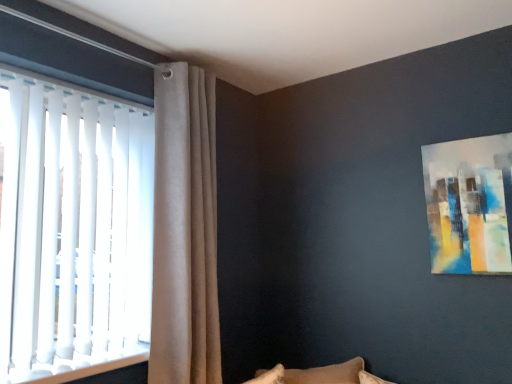
Where is `abstract painting at upper right`? This screenshot has width=512, height=384. abstract painting at upper right is located at coordinates (469, 204).

Measure the distance between point [499,211] and camera.

The depth of point [499,211] is 1.83 meters.

Find the location of `white vertical blinds at left`. white vertical blinds at left is located at coordinates (72, 228).

Does white vertical blinds at left appear on the left side of abstract painting at upper right?

Correct, you'll find white vertical blinds at left to the left of abstract painting at upper right.

Is white vertical blinds at left bigger than abstract painting at upper right?

Correct, white vertical blinds at left is larger in size than abstract painting at upper right.

Measure the distance between white vertical blinds at left and abstract painting at upper right.

The distance of white vertical blinds at left from abstract painting at upper right is 5.10 feet.

From a real-world perspective, which is physically below, white vertical blinds at left or abstract painting at upper right?

white vertical blinds at left, from a real-world perspective.

Can you see white vertical blinds at left touching beige velvet curtain at upper left?

No, white vertical blinds at left is not with beige velvet curtain at upper left.

In the scene shown: Is white vertical blinds at left to the right of beige velvet curtain at upper left from the viewer's perspective?

Incorrect, white vertical blinds at left is not on the right side of beige velvet curtain at upper left.

The width and height of the screenshot is (512, 384). I want to click on curtain located on the right of white vertical blinds at left, so click(185, 230).

From their relative heights in the image, would you say white vertical blinds at left is taller or shorter than beige velvet curtain at upper left?

Clearly, white vertical blinds at left is shorter compared to beige velvet curtain at upper left.

From a real-world perspective, is abstract painting at upper right physically located above or below white vertical blinds at left?

Clearly, from a real-world perspective, abstract painting at upper right is above white vertical blinds at left.

Is point (498, 237) less distant than point (9, 92)?

No.

From the image's perspective, which one is positioned lower, abstract painting at upper right or white vertical blinds at left?

From the image's view, white vertical blinds at left is below.

Is white vertical blinds at left a part of abstract painting at upper right?

No.

Which object is positioned more to the right, abstract painting at upper right or beige velvet curtain at upper left?

abstract painting at upper right is more to the right.

Does abstract painting at upper right contain beige velvet curtain at upper left?

Actually, beige velvet curtain at upper left is outside abstract painting at upper right.

Does abstract painting at upper right have a greater width compared to beige velvet curtain at upper left?

No.

From a real-world perspective, which is physically below, beige velvet curtain at upper left or abstract painting at upper right?

beige velvet curtain at upper left, from a real-world perspective.

Is beige velvet curtain at upper left bigger or smaller than abstract painting at upper right?

beige velvet curtain at upper left is bigger than abstract painting at upper right.

Are beige velvet curtain at upper left and abstract painting at upper right far apart?

Yes, beige velvet curtain at upper left and abstract painting at upper right are quite far apart.

Considering the relative sizes of beige velvet curtain at upper left and abstract painting at upper right in the image provided, is beige velvet curtain at upper left shorter than abstract painting at upper right?

No.

Does beige velvet curtain at upper left appear on the right side of white vertical blinds at left?

Indeed, beige velvet curtain at upper left is positioned on the right side of white vertical blinds at left.

What's the angular difference between beige velvet curtain at upper left and white vertical blinds at left's facing directions?

The angular difference between beige velvet curtain at upper left and white vertical blinds at left is 0.00195 degrees.

Between beige velvet curtain at upper left and white vertical blinds at left, which one has less height?

white vertical blinds at left.

Does beige velvet curtain at upper left have a lesser width compared to white vertical blinds at left?

No.

Image resolution: width=512 pixels, height=384 pixels. What are the coordinates of `window to the left of abstract painting at upper right` in the screenshot? It's located at (72, 228).

In order to click on window in front of the beige velvet curtain at upper left in this screenshot , I will do `click(72, 228)`.

Looking at the image, which one is located further to white vertical blinds at left, beige velvet curtain at upper left or abstract painting at upper right?

abstract painting at upper right is further to white vertical blinds at left.

Which object lies nearer to the anchor point abstract painting at upper right, white vertical blinds at left or beige velvet curtain at upper left?

The object closer to abstract painting at upper right is beige velvet curtain at upper left.

Based on their spatial positions, is abstract painting at upper right or white vertical blinds at left closer to beige velvet curtain at upper left?

white vertical blinds at left.

Based on their spatial positions, is beige velvet curtain at upper left or white vertical blinds at left further from abstract painting at upper right?

Among the two, white vertical blinds at left is located further to abstract painting at upper right.

Estimate the real-world distances between objects in this image. Which object is closer to white vertical blinds at left, abstract painting at upper right or beige velvet curtain at upper left?

beige velvet curtain at upper left is positioned closer to the anchor white vertical blinds at left.

Looking at the image, which one is located closer to beige velvet curtain at upper left, white vertical blinds at left or abstract painting at upper right?

white vertical blinds at left is closer to beige velvet curtain at upper left.

Image resolution: width=512 pixels, height=384 pixels. Identify the location of curtain between white vertical blinds at left and abstract painting at upper right from left to right. (185, 230).